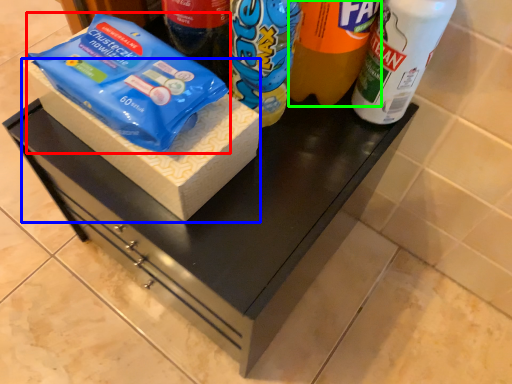
Question: Considering the real-world distances, which object is farthest from food (highlighted by a red box)? box (highlighted by a blue box) or drinking straw (highlighted by a green box)?

Choices:
 (A) box
 (B) drinking straw

Answer: (B)